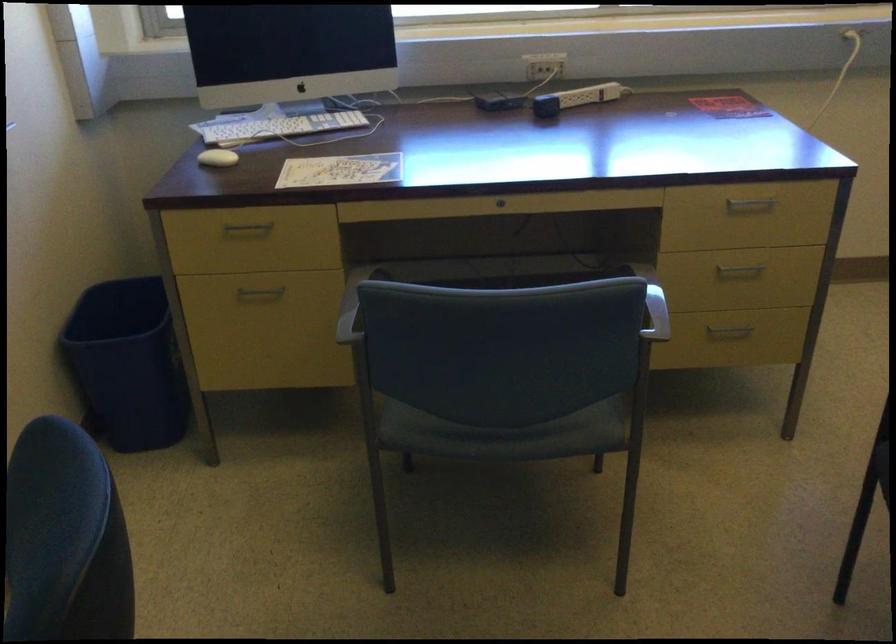
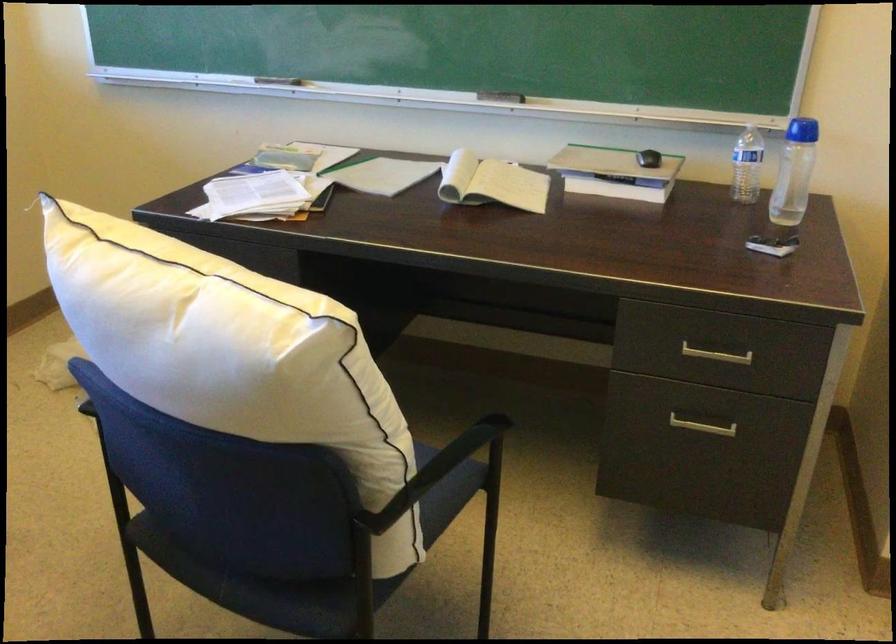
Question: How did the camera likely rotate?

Choices:
 (A) Left
 (B) Right
 (C) Up
 (D) Down

Answer: (B)